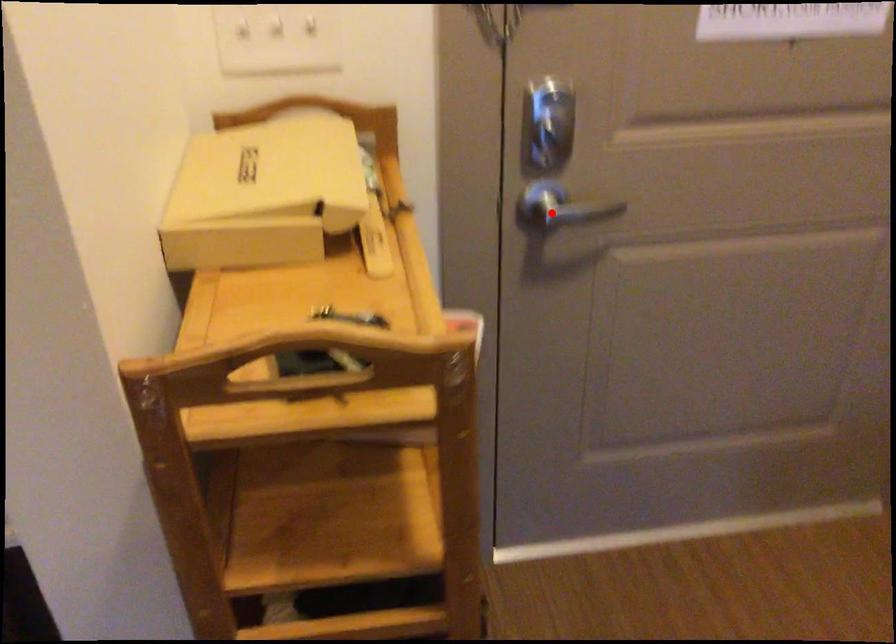
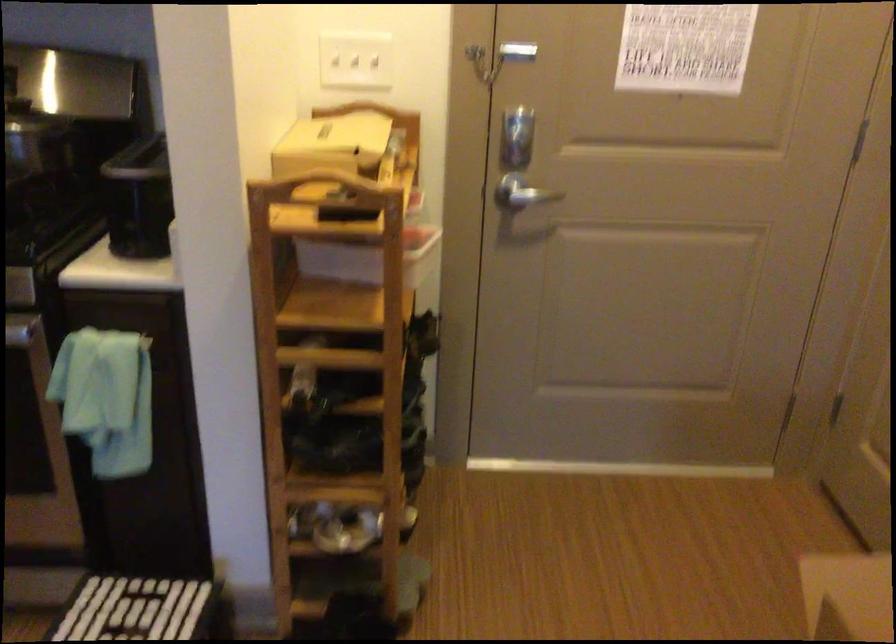
Question: I am providing you with two images of the same scene from different viewpoints. Given a red point in image1, look at the same physical point in image2. Is it:

Choices:
 (A) Closer to the viewpoint
 (B) Farther from the viewpoint

Answer: (B)